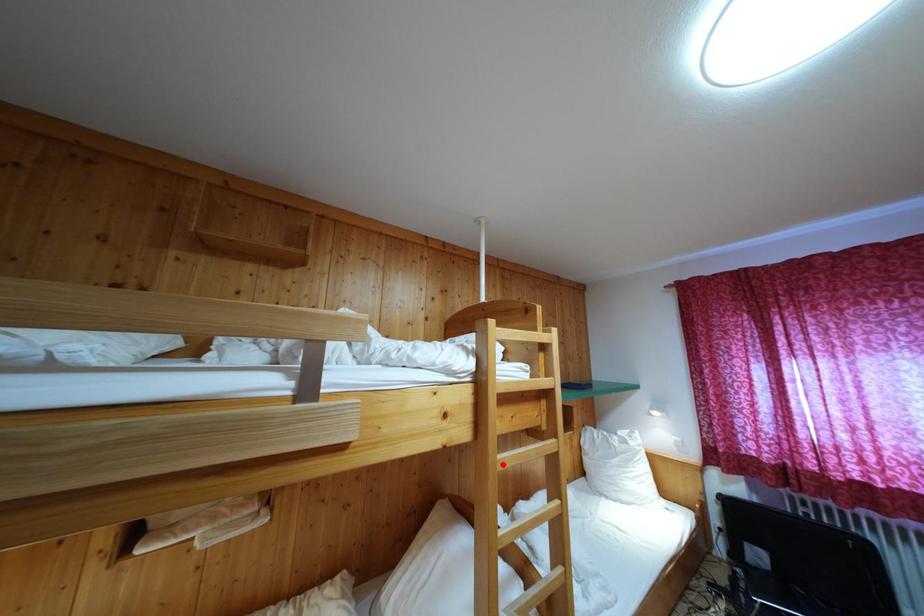
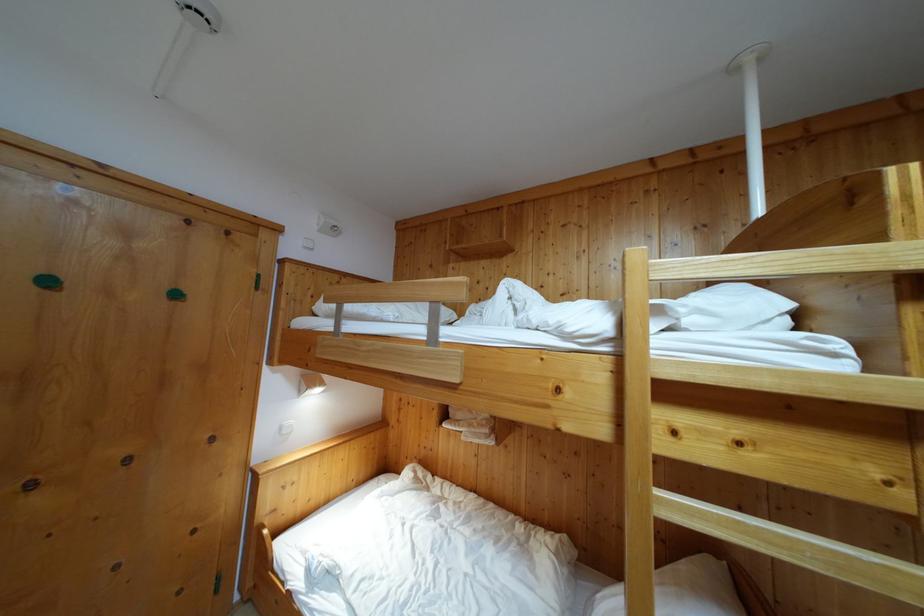
Find the pixel in the second image that matches the highlighted location in the first image.

(663, 500)